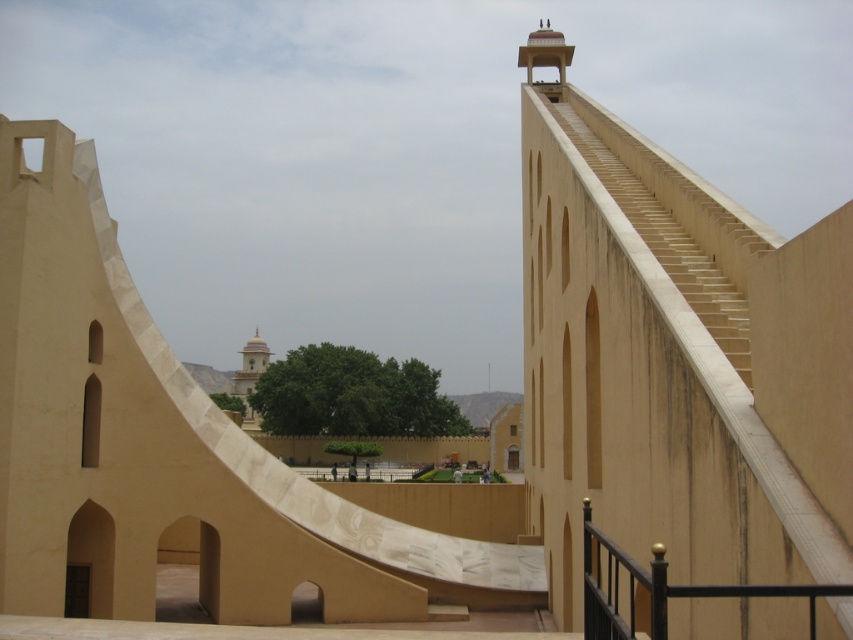
You are a tourist standing at the camera position in the Jantar Mantar observatory. You want to touch the black metal railing at lower right. Can you reach it without moving your feet?

The black metal railing at lower right is 21.28 meters from camera, so you cannot reach it without moving your feet since it is too far away.

You are standing in front of the Jantar Mantar observatory and notice two points marked on the curved wall. The first point is at coordinates point (x=724, y=276) and the second is at point (x=254, y=419). Which point is nearer to your current position?

Point (x=724, y=276) is closer to the camera than point (x=254, y=419), so the first point is nearer to your current position.